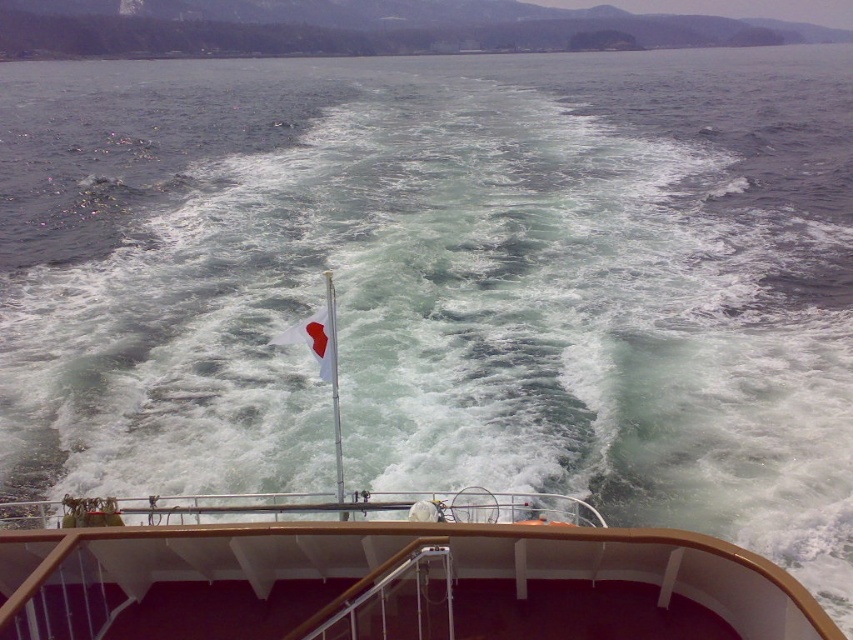
You are standing on the ship and want to know which object takes up more space in the image between the brown polished wood deck at lower center and the white plastic flagpole at center. Which one is larger?

The brown polished wood deck at lower center is smaller than the white plastic flagpole at center, so the white plastic flagpole at center takes up more space in the image.